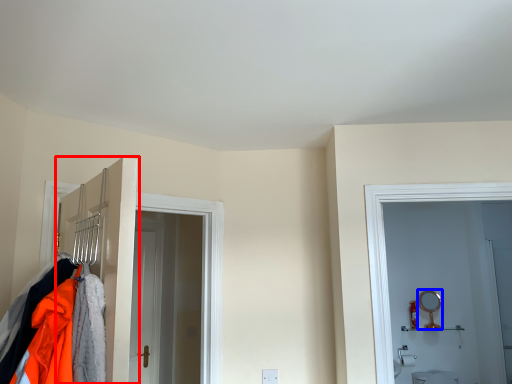
Question: Which object appears closest to the camera in this image, door (highlighted by a red box) or mirror (highlighted by a blue box)?

Choices:
 (A) door
 (B) mirror

Answer: (A)